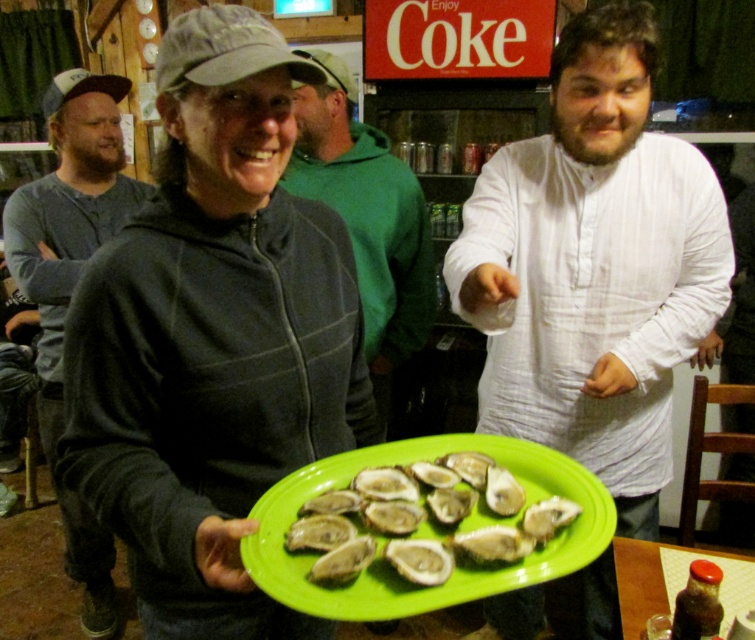
Between point (396, 326) and point (430, 515), which one is positioned behind?

Point (396, 326)

Is point (362, 154) positioned behind point (302, 524)?

Yes.

Locate an element on the screen. green fleece hoodie at center is located at coordinates (367, 218).

Find the location of a particular element. green fleece hoodie at center is located at coordinates point(367,218).

Is point (236, 45) farther from camera compared to point (362, 502)?

No.

Where is `matte gray hoodie at center`? The image size is (755, 640). matte gray hoodie at center is located at coordinates (213, 337).

Identify the location of matte gray hoodie at center. Image resolution: width=755 pixels, height=640 pixels. (213, 337).

Between matte gray hoodie at center and green fleece hoodie at center, which one is positioned higher?

green fleece hoodie at center is above.

Image resolution: width=755 pixels, height=640 pixels. In order to click on matte gray hoodie at center in this screenshot , I will do `click(213, 337)`.

Locate an element on the screen. matte gray hoodie at center is located at coordinates (213, 337).